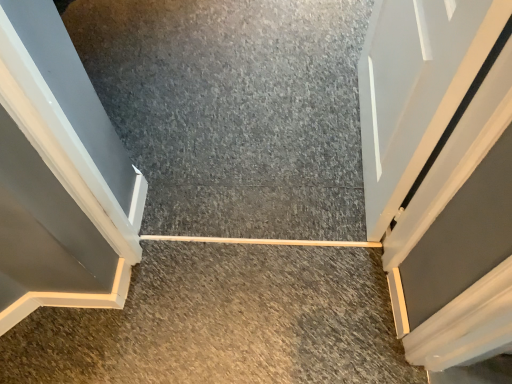
Question: From a real-world perspective, is white glossy door at upper right located higher than smooth concrete at center, the 1th concrete positioned from the top?

Choices:
 (A) no
 (B) yes

Answer: (B)

Question: From a real-world perspective, does white glossy door at upper right sit lower than smooth concrete at center, the second concrete positioned from the bottom?

Choices:
 (A) yes
 (B) no

Answer: (B)

Question: Is white glossy door at upper right shorter than smooth concrete at center, the 2th concrete viewed from the front?

Choices:
 (A) no
 (B) yes

Answer: (A)

Question: Is white glossy door at upper right further to the viewer compared to smooth concrete at center, the 2th concrete viewed from the front?

Choices:
 (A) no
 (B) yes

Answer: (A)

Question: Does white glossy door at upper right have a lesser width compared to smooth concrete at center, the 2th concrete viewed from the front?

Choices:
 (A) yes
 (B) no

Answer: (A)

Question: From the image's perspective, does white glossy door at upper right appear lower than smooth concrete at center, the 2th concrete viewed from the front?

Choices:
 (A) no
 (B) yes

Answer: (B)

Question: Considering the relative sizes of smooth concrete at center, the second concrete positioned from the back, and white glossy door at upper right in the image provided, is smooth concrete at center, the second concrete positioned from the back, wider than white glossy door at upper right?

Choices:
 (A) no
 (B) yes

Answer: (B)

Question: Is smooth concrete at center, the second concrete positioned from the back, further to camera compared to white glossy door at upper right?

Choices:
 (A) yes
 (B) no

Answer: (A)

Question: Is smooth concrete at center, which is the 2th concrete from top to bottom, at the left side of white glossy door at upper right?

Choices:
 (A) no
 (B) yes

Answer: (B)

Question: Is smooth concrete at center, acting as the 1th concrete starting from the bottom, oriented towards white glossy door at upper right?

Choices:
 (A) no
 (B) yes

Answer: (A)

Question: Considering the relative sizes of smooth concrete at center, acting as the 1th concrete starting from the bottom, and white glossy door at upper right in the image provided, is smooth concrete at center, acting as the 1th concrete starting from the bottom, taller than white glossy door at upper right?

Choices:
 (A) yes
 (B) no

Answer: (B)

Question: From a real-world perspective, does smooth concrete at center, the second concrete positioned from the back, sit lower than white glossy door at upper right?

Choices:
 (A) no
 (B) yes

Answer: (B)

Question: Is smooth concrete at center, the 1th concrete positioned from the top, in contact with smooth concrete at center, acting as the 1th concrete starting from the bottom?

Choices:
 (A) no
 (B) yes

Answer: (A)